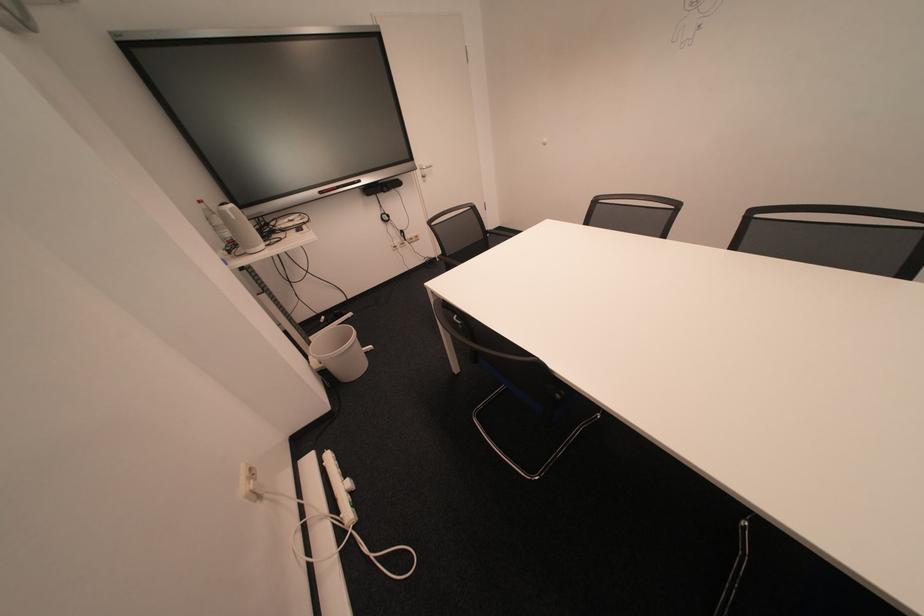
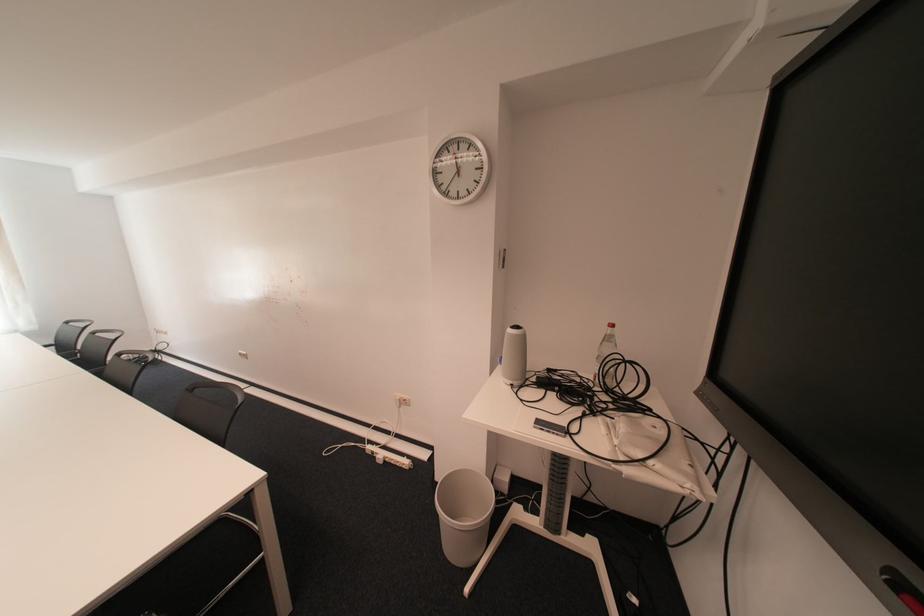
Find the pixel in the second image that matches pixel 274 246 in the first image.

(520, 383)